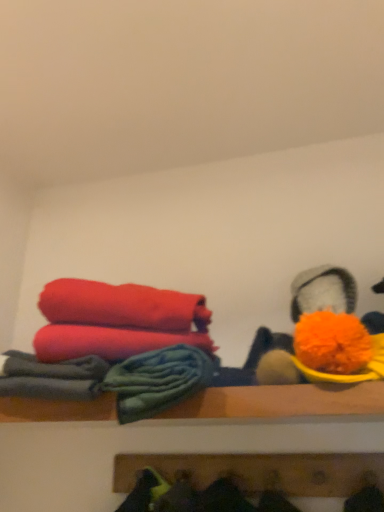
Question: Should I look upward or downward to see wooden shelf at center, the 1th shelf when ordered from top to bottom?

Choices:
 (A) down
 (B) up

Answer: (A)

Question: Can you confirm if wooden shelf at center, the 1th shelf when ordered from top to bottom, is bigger than soft cotton towels at left?

Choices:
 (A) no
 (B) yes

Answer: (B)

Question: Is wooden shelf at center, the 1th shelf when ordered from top to bottom, beside soft cotton towels at left?

Choices:
 (A) no
 (B) yes

Answer: (B)

Question: Could you tell me if wooden shelf at center, placed as the 2th shelf when sorted from bottom to top, is turned towards soft cotton towels at left?

Choices:
 (A) no
 (B) yes

Answer: (B)

Question: Is wooden shelf at center, the 1th shelf when ordered from top to bottom, turned away from soft cotton towels at left?

Choices:
 (A) yes
 (B) no

Answer: (B)

Question: Considering the relative sizes of wooden shelf at center, the 1th shelf when ordered from top to bottom, and soft cotton towels at left in the image provided, is wooden shelf at center, the 1th shelf when ordered from top to bottom, taller than soft cotton towels at left?

Choices:
 (A) yes
 (B) no

Answer: (B)

Question: Is wooden shelf at center, placed as the 2th shelf when sorted from bottom to top, further to the viewer compared to soft cotton towels at left?

Choices:
 (A) no
 (B) yes

Answer: (A)

Question: Is soft cotton towels at left to the left of wooden shelf at center, the 1th shelf when ordered from top to bottom, from the viewer's perspective?

Choices:
 (A) yes
 (B) no

Answer: (A)

Question: From the image's perspective, does soft cotton towels at left appear higher than wooden shelf at center, placed as the 2th shelf when sorted from bottom to top?

Choices:
 (A) no
 (B) yes

Answer: (B)

Question: Does soft cotton towels at left lie behind wooden shelf at center, the 1th shelf when ordered from top to bottom?

Choices:
 (A) no
 (B) yes

Answer: (B)

Question: Considering the relative sizes of soft cotton towels at left and wooden shelf at center, the 1th shelf when ordered from top to bottom, in the image provided, is soft cotton towels at left bigger than wooden shelf at center, the 1th shelf when ordered from top to bottom,?

Choices:
 (A) yes
 (B) no

Answer: (B)

Question: From the image's perspective, is soft cotton towels at left below wooden shelf at center, placed as the 2th shelf when sorted from bottom to top?

Choices:
 (A) yes
 (B) no

Answer: (B)

Question: Is soft cotton towels at left to the right of wooden shelf at center, the 1th shelf when ordered from top to bottom, from the viewer's perspective?

Choices:
 (A) yes
 (B) no

Answer: (B)

Question: Considering the relative positions of wooden coat rack at lower center, which is counted as the 2th shelf, starting from the top, and soft cotton towels at left in the image provided, is wooden coat rack at lower center, which is counted as the 2th shelf, starting from the top, to the right of soft cotton towels at left from the viewer's perspective?

Choices:
 (A) yes
 (B) no

Answer: (A)